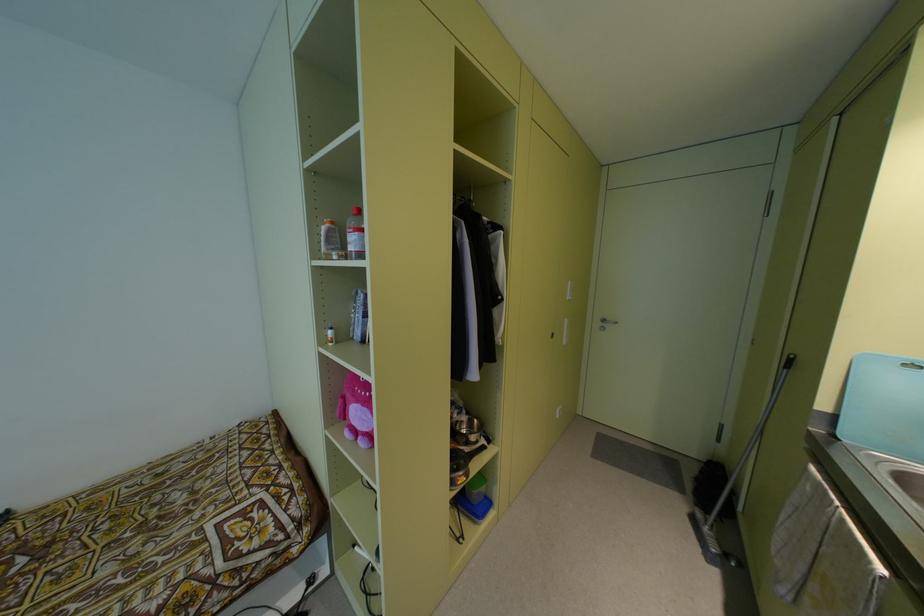
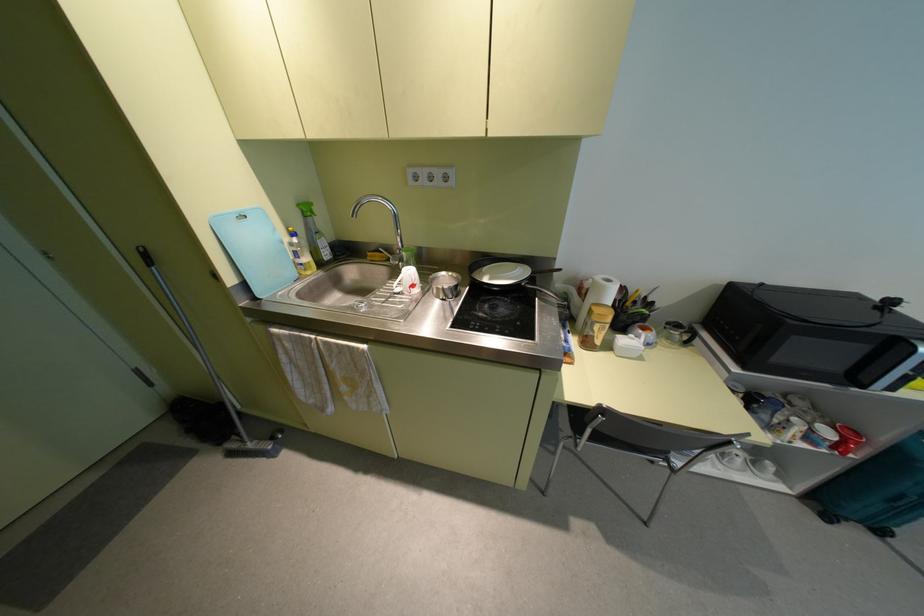
Where in the second image is the point corresponding to (x=706, y=530) from the first image?

(250, 445)